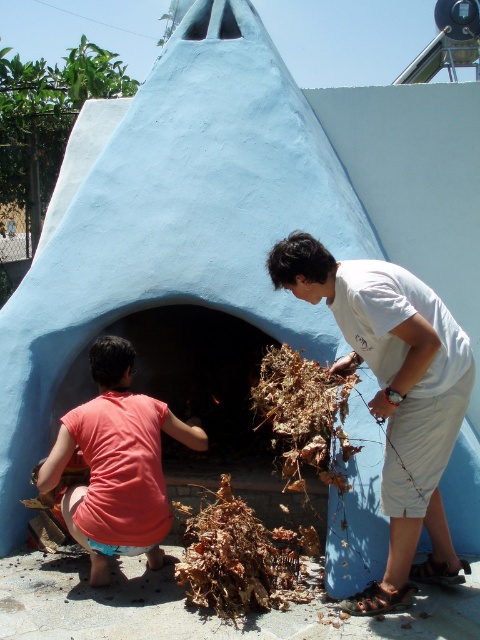
Question: Is white cotton shirt at center thinner than pink fabric shirt at lower left?

Choices:
 (A) yes
 (B) no

Answer: (B)

Question: Which point is closer to the camera taking this photo?

Choices:
 (A) (399, 289)
 (B) (118, 404)

Answer: (A)

Question: Which object appears farthest from the camera in this image?

Choices:
 (A) pink fabric shirt at lower left
 (B) white cotton shirt at center

Answer: (A)

Question: Can you confirm if white cotton shirt at center is positioned to the left of pink fabric shirt at lower left?

Choices:
 (A) no
 (B) yes

Answer: (A)

Question: Which point appears closest to the camera in this image?

Choices:
 (A) coord(462,336)
 (B) coord(142,502)

Answer: (A)

Question: Does white cotton shirt at center appear on the right side of pink fabric shirt at lower left?

Choices:
 (A) yes
 (B) no

Answer: (A)